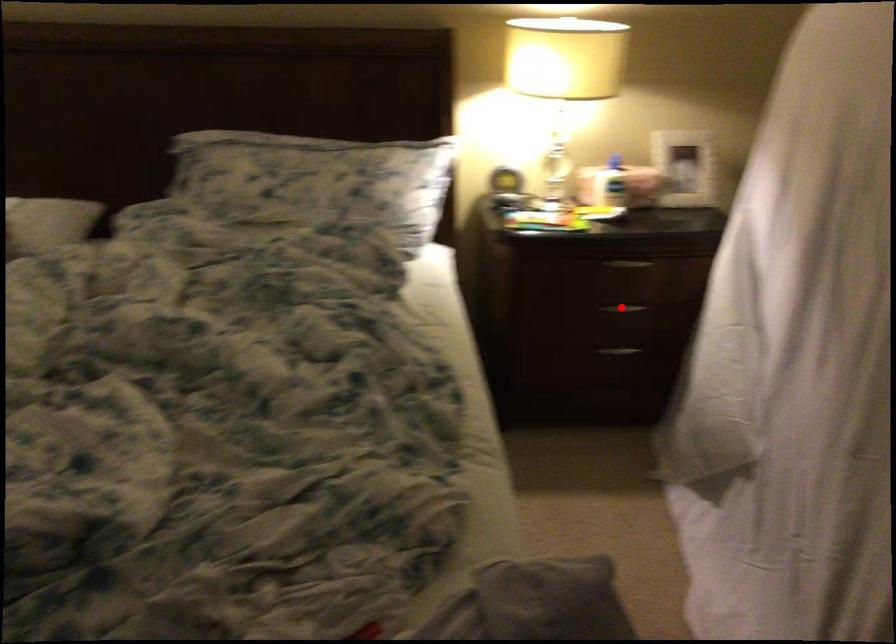
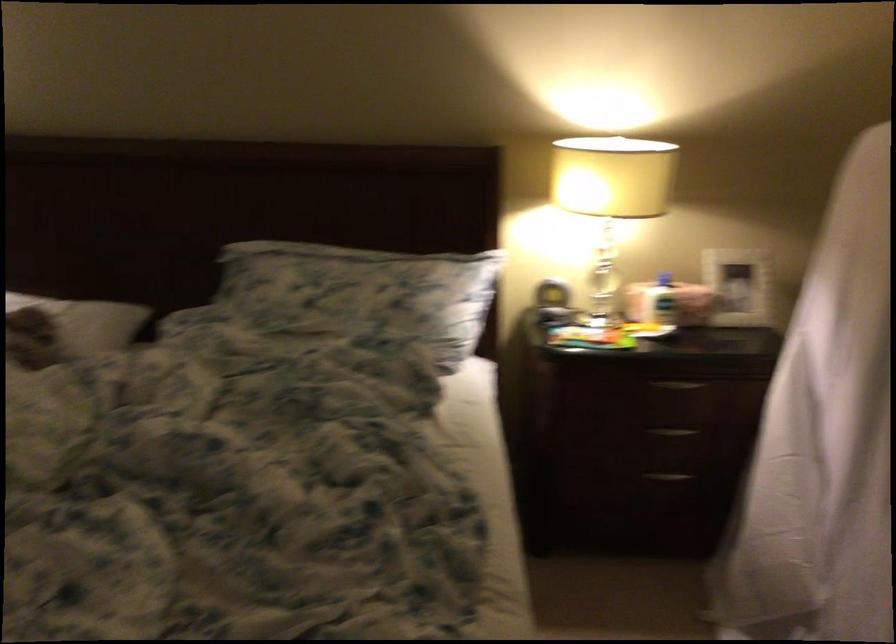
Question: I am providing you with two images of the same scene from different viewpoints. A red point is marked on the first image. Is the red point's position out of view in image 2?

Choices:
 (A) Yes
 (B) No

Answer: (B)